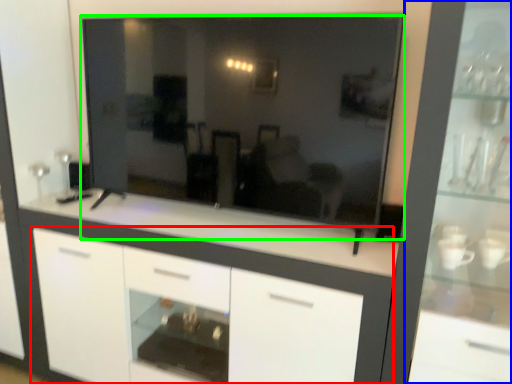
Question: Which object is positioned closest to cabinetry (highlighted by a red box)? Select from dresser (highlighted by a blue box) and mirror (highlighted by a green box).

Choices:
 (A) dresser
 (B) mirror

Answer: (B)